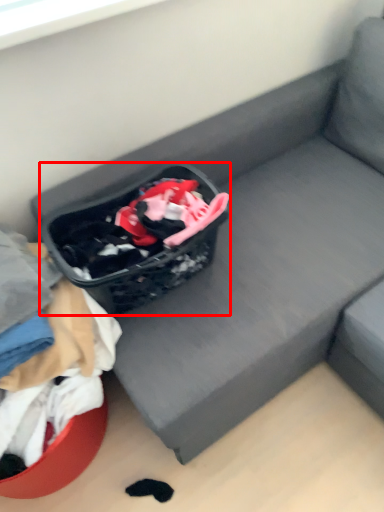
Question: Observing the image, what is the correct spatial positioning of shopping basket (annotated by the red box) in reference to clothing?

Choices:
 (A) left
 (B) right

Answer: (B)